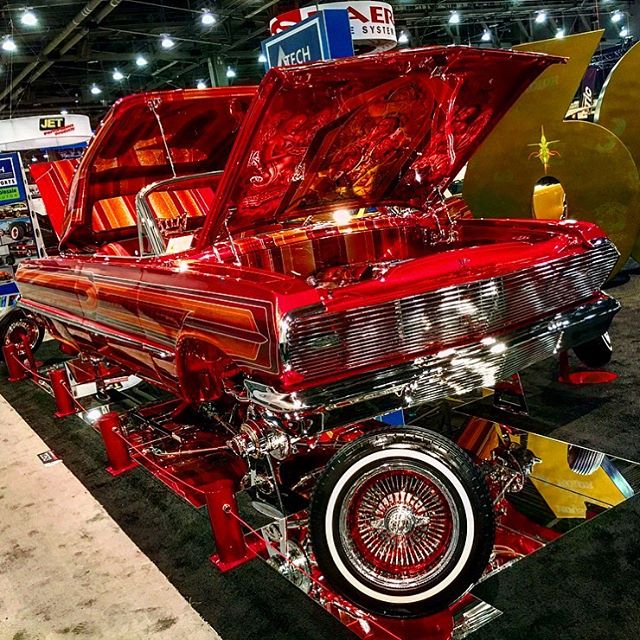
You are a GUI agent. You are given a task and a screenshot of the screen. Output one action in this format:
    pyautogui.click(x=<x>, y=<y>)
    Task: Click on the carpet
    The image size is (640, 640).
    Given the screenshot: What is the action you would take?
    584,573